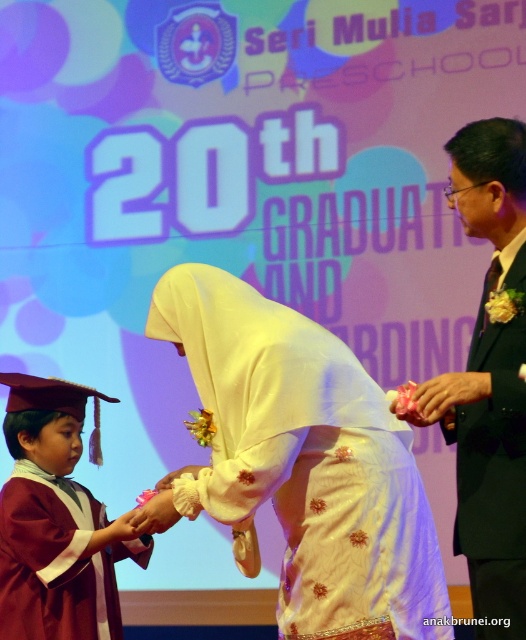
You are attending a graduation ceremony and see a white satin dress at center and a black suit at right. Which one is more to the left?

The white satin dress at center is more to the left than the black suit at right.

You are a photographer at the graduation ceremony. You need to capture a photo of the white satin dress at center and the maroon satin graduation gown at lower left. Which one appears larger in the photo?

The white satin dress at center appears larger in the photo than the maroon satin graduation gown at lower left because it is bigger in size.

You are a photographer at the graduation ceremony. You want to take a photo that includes both the black suit at right and the maroon satin graduation gown at lower left. Which object should be placed higher in the frame to ensure both are visible?

The black suit at right should be placed higher in the frame since it is located above the maroon satin graduation gown at lower left, ensuring both are visible.